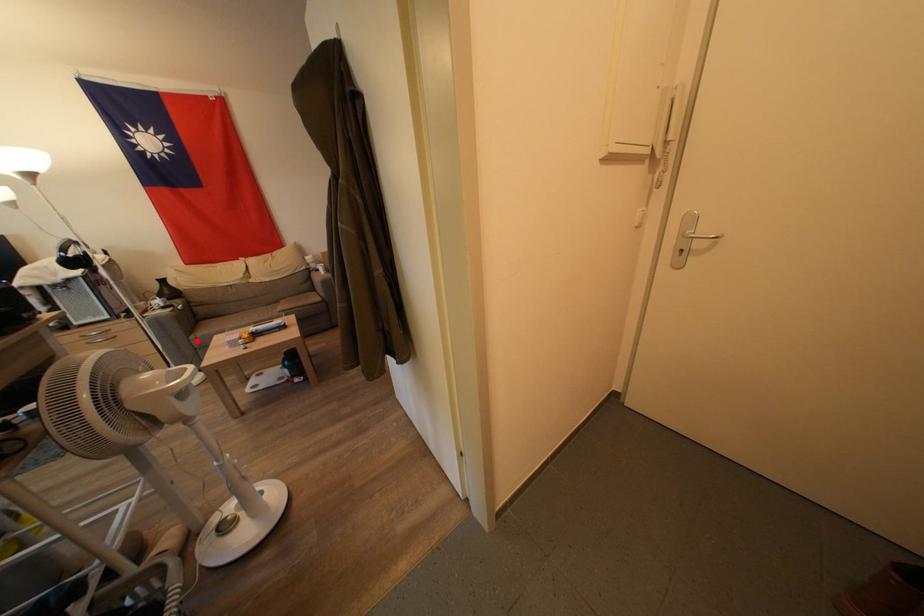
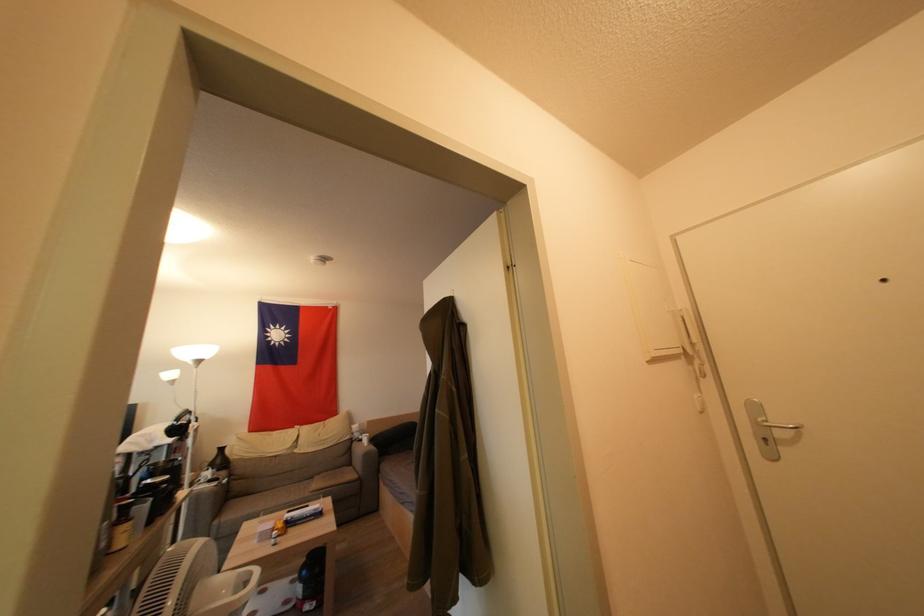
Question: I am providing you with two images of the same scene from different viewpoints. Given a red point in image1, look at the same physical point in image2. Is it:

Choices:
 (A) Closer to the viewpoint
 (B) Farther from the viewpoint

Answer: (A)